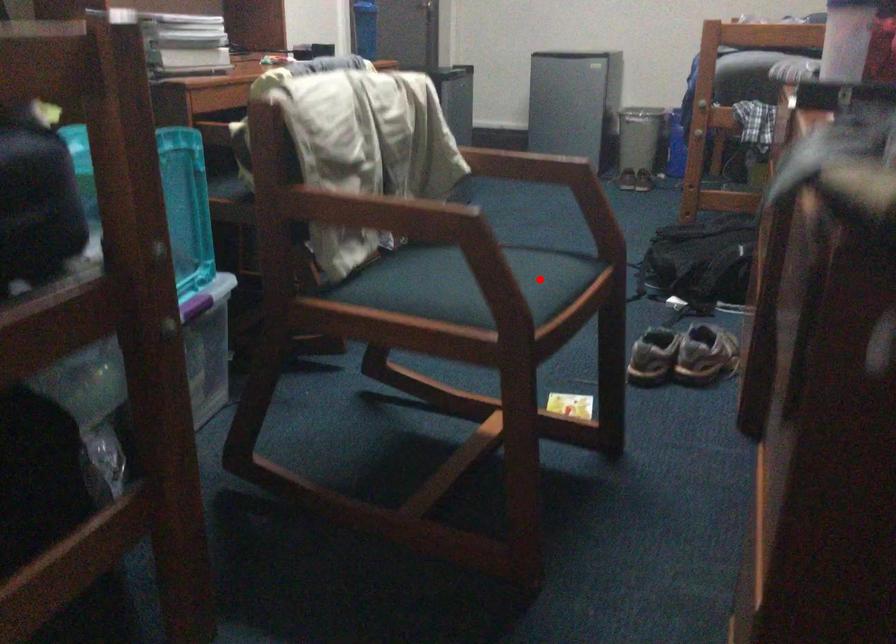
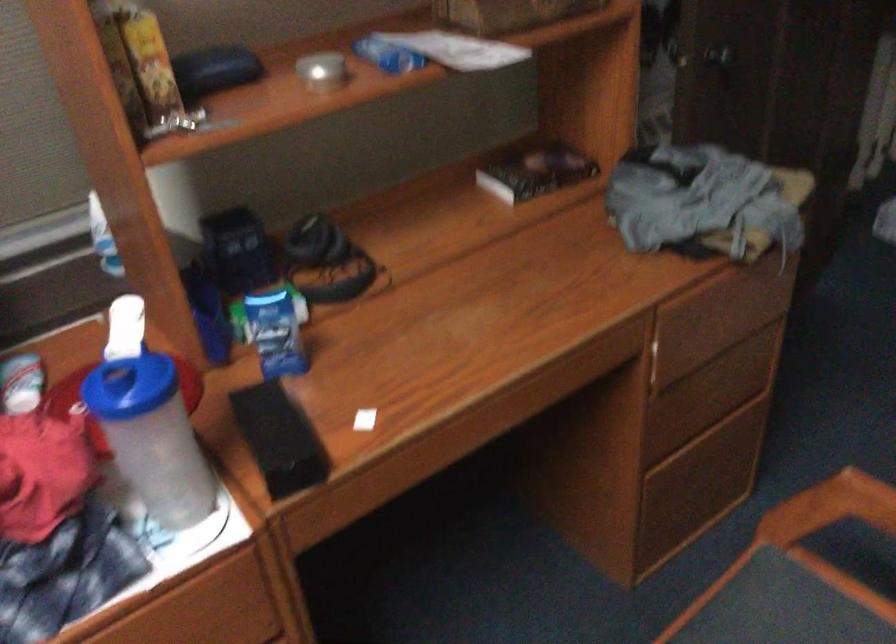
Find the pixel in the second image that matches the highlighted location in the first image.

(830, 507)